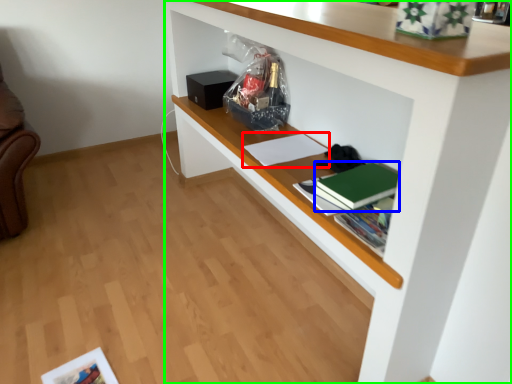
Question: Based on their relative distances, which object is farther from book (highlighted by a red box)? Choose from paperback book (highlighted by a blue box) and shelf (highlighted by a green box).

Choices:
 (A) paperback book
 (B) shelf

Answer: (B)